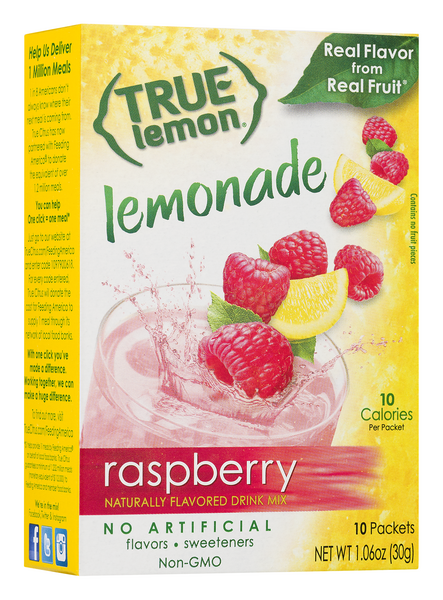
You are a GUI agent. You are given a task and a screenshot of the screen. Output one action in this format:
    pyautogui.click(x=<x>, y=<y>)
    Task: Click on the glass
    
    Given the screenshot: What is the action you would take?
    pyautogui.click(x=136, y=413)